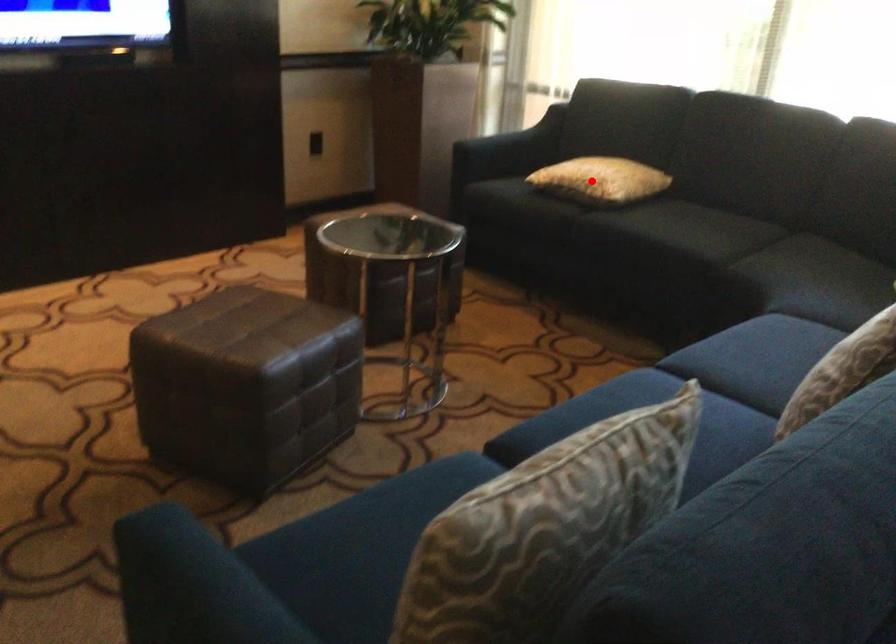
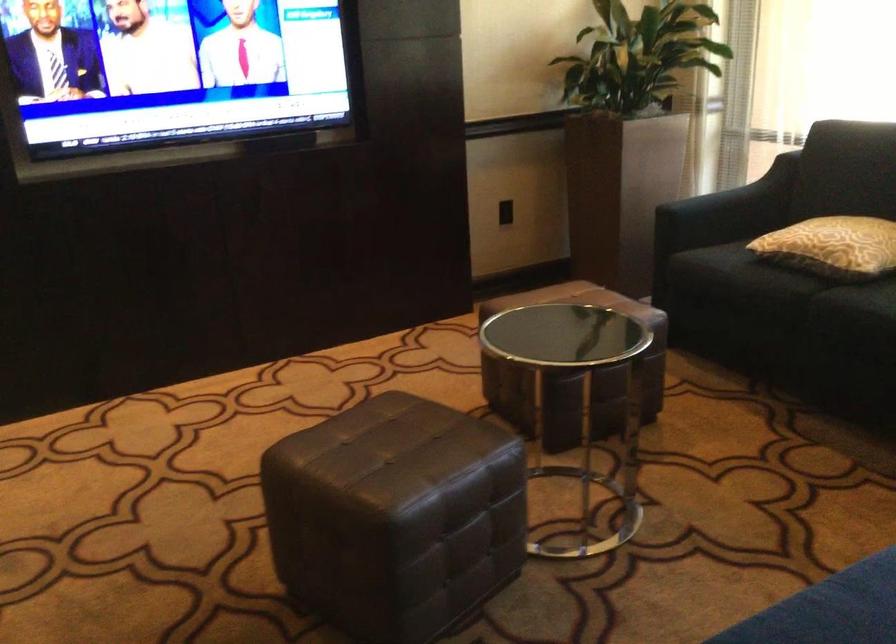
Locate, in the second image, the point that corresponds to the highlighted location in the first image.

(832, 245)